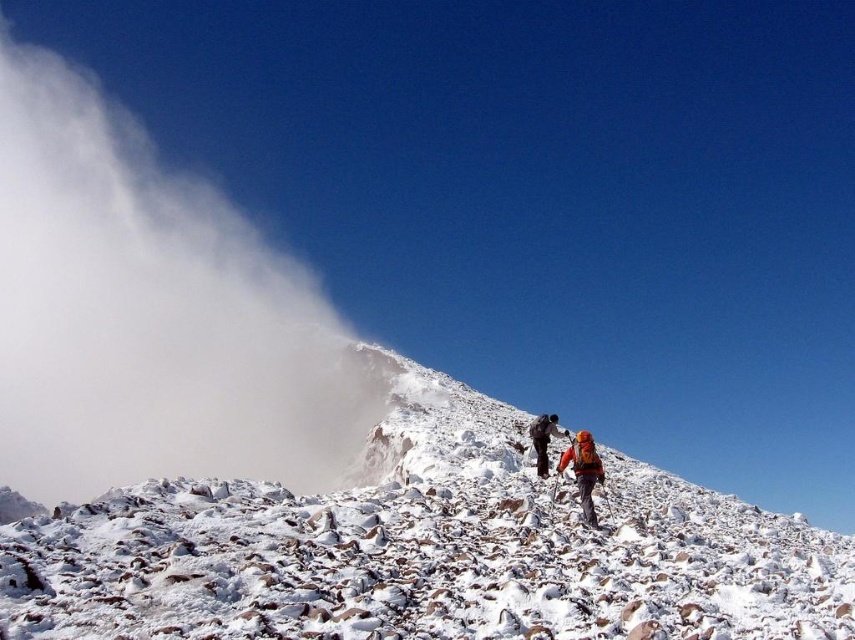
Based on the coordinates provided in the scene description, where is the white fluffy cloud at upper left located?

The white fluffy cloud at upper left is located at point (152,316).

You are a mountain climber looking at the scene. You see the white fluffy cloud at upper left and the orange fabric backpack at center. Which object is closer to you?

The white fluffy cloud at upper left is closer to you because the orange fabric backpack at center is behind it.